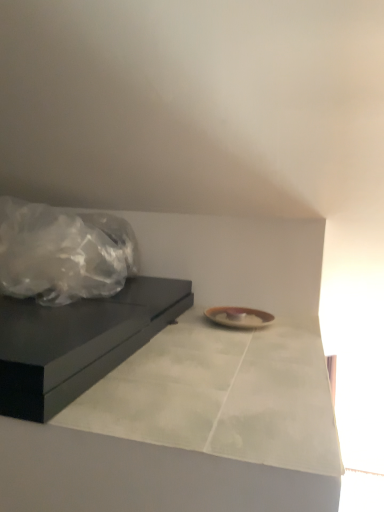
This screenshot has height=512, width=384. What do you see at coordinates (188, 429) in the screenshot?
I see `white marble countertop at center` at bounding box center [188, 429].

What is the approximate width of white marble countertop at center?

white marble countertop at center is 23.51 inches wide.

I want to click on white marble countertop at center, so click(x=188, y=429).

Measure the distance between matte black table at left and camera.

matte black table at left and camera are 16.11 inches apart from each other.

Where is `matte black table at left`? The height and width of the screenshot is (512, 384). matte black table at left is located at coordinates (77, 342).

Image resolution: width=384 pixels, height=512 pixels. What do you see at coordinates (77, 342) in the screenshot?
I see `matte black table at left` at bounding box center [77, 342].

You are a GUI agent. You are given a task and a screenshot of the screen. Output one action in this format:
    pyautogui.click(x=<x>, y=<y>)
    Task: Click on the white marble countertop at center
    
    Given the screenshot: What is the action you would take?
    pyautogui.click(x=188, y=429)

Considering the positions of objects matte black table at left and white marble countertop at center in the image provided, who is more to the right, matte black table at left or white marble countertop at center?

From the viewer's perspective, white marble countertop at center appears more on the right side.

Is matte black table at left in front of or behind white marble countertop at center in the image?

Clearly, matte black table at left is behind white marble countertop at center.

Considering the positions of point (184, 292) and point (339, 475), is point (184, 292) closer or farther from the camera than point (339, 475)?

Point (184, 292) is farther from the camera than point (339, 475).

From the image's perspective, is matte black table at left located above or below white marble countertop at center?

Clearly, from the image's perspective, matte black table at left is above white marble countertop at center.

From a real-world perspective, does matte black table at left sit lower than white marble countertop at center?

Incorrect, from a real-world perspective, matte black table at left is higher than white marble countertop at center.

Based on the photo, can you confirm if matte black table at left is wider than white marble countertop at center?

Indeed, matte black table at left has a greater width compared to white marble countertop at center.

Who is shorter, matte black table at left or white marble countertop at center?

white marble countertop at center.

Is matte black table at left bigger than white marble countertop at center?

Yes.

Do you think matte black table at left is within white marble countertop at center, or outside of it?

matte black table at left is spatially situated outside white marble countertop at center.

Are matte black table at left and white marble countertop at center located far from each other?

matte black table at left is actually quite close to white marble countertop at center.

Is matte black table at left looking in the opposite direction of white marble countertop at center?

No.

What's the angular difference between matte black table at left and white marble countertop at center's facing directions?

0.368 degrees.

Locate an element on the screen. The width and height of the screenshot is (384, 512). counter top that appears below the matte black table at left (from a real-world perspective) is located at coordinates (188, 429).

Is white marble countertop at center to the right of matte black table at left from the viewer's perspective?

Yes.

Is the depth of white marble countertop at center less than that of matte black table at left?

That is True.

Is point (264, 378) positioned after point (187, 287)?

No.

From the image's perspective, which is below, white marble countertop at center or matte black table at left?

white marble countertop at center is shown below in the image.

From a real-world perspective, which is physically below, white marble countertop at center or matte black table at left?

white marble countertop at center, from a real-world perspective.

Between white marble countertop at center and matte black table at left, which one has smaller width?

Thinner between the two is white marble countertop at center.

Can you confirm if white marble countertop at center is shorter than matte black table at left?

Yes.

Looking at this image, does white marble countertop at center have a smaller size compared to matte black table at left?

Yes.

Choose the correct answer: Is white marble countertop at center inside matte black table at left or outside it?

white marble countertop at center is spatially situated outside matte black table at left.

Is white marble countertop at center with matte black table at left?

white marble countertop at center is not next to matte black table at left, and they're not touching.

Is matte black table at left at the back of white marble countertop at center?

No, white marble countertop at center is not facing the opposite direction of matte black table at left.

Locate an element on the screen. The width and height of the screenshot is (384, 512). table behind the white marble countertop at center is located at coordinates (77, 342).

Image resolution: width=384 pixels, height=512 pixels. Identify the location of counter top that is on the right side of matte black table at left. click(x=188, y=429).

This screenshot has width=384, height=512. In order to click on counter top that is under the matte black table at left (from a real-world perspective) in this screenshot , I will do `click(188, 429)`.